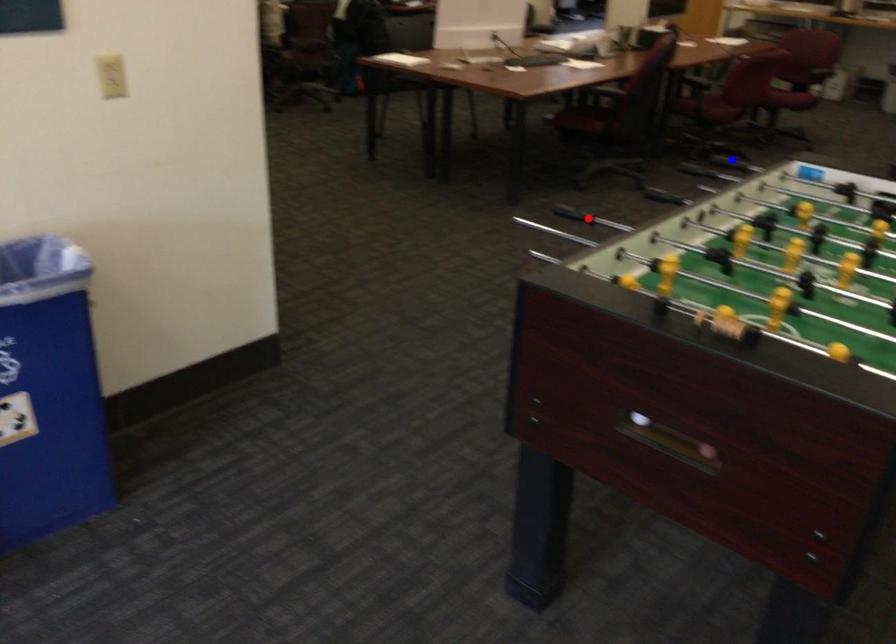
Question: Two points are marked on the image. Which point is closer to the camera?

Choices:
 (A) Blue point is closer.
 (B) Red point is closer.

Answer: (B)